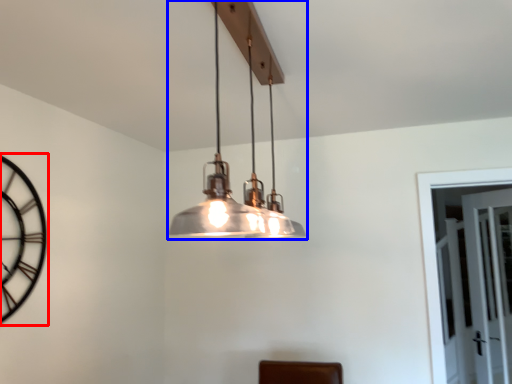
Question: Among these objects, which one is farthest to the camera, clock (highlighted by a red box) or lamp (highlighted by a blue box)?

Choices:
 (A) clock
 (B) lamp

Answer: (A)